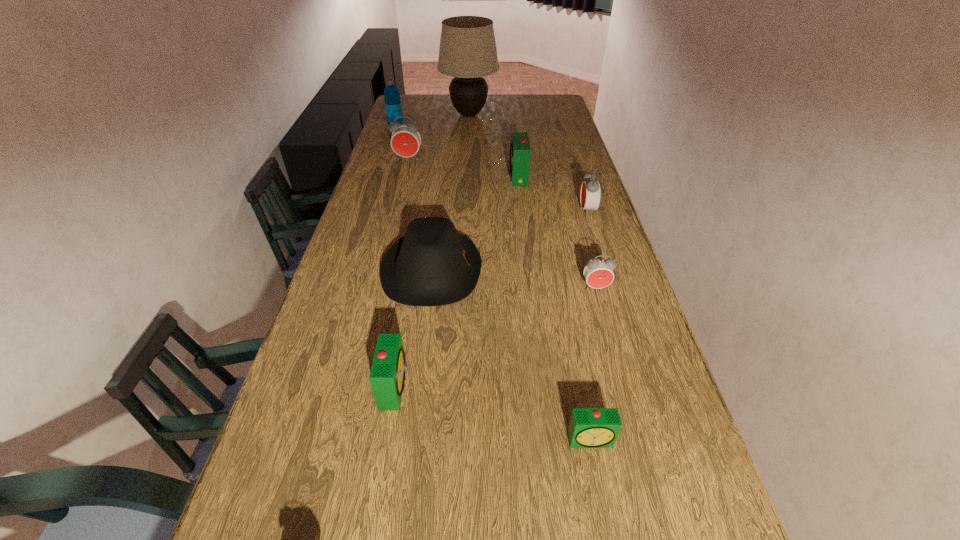
Where is `alarm clock present at the left edge`? alarm clock present at the left edge is located at coordinates (405, 141).

Image resolution: width=960 pixels, height=540 pixels. I want to click on fedora that is at the left edge, so click(x=431, y=265).

The image size is (960, 540). Find the location of `free space at the far edge of the desktop`. free space at the far edge of the desktop is located at coordinates (448, 111).

This screenshot has width=960, height=540. Identify the location of free space at the left edge of the desktop. (361, 369).

Identify the location of vacant space at the right edge of the desktop. tap(548, 156).

Locate an element on the screen. This screenshot has width=960, height=540. empty space that is in between the seventh object from left to right and the gray fedora is located at coordinates (512, 356).

You are a GUI agent. You are given a task and a screenshot of the screen. Output one action in this format:
    pyautogui.click(x=<x>, y=<y>)
    Task: Click on the blank region between the fourth farthest alarm clock and the tallest alarm clock
    The height and width of the screenshot is (540, 960).
    Given the screenshot: What is the action you would take?
    pyautogui.click(x=502, y=224)

You are a GUI agent. You are given a task and a screenshot of the screen. Output one action in this format:
    pyautogui.click(x=<x>, y=<y>)
    Task: Click on the vacant area that lies between the gray fedora and the lampshade
    The height and width of the screenshot is (540, 960).
    Given the screenshot: What is the action you would take?
    coord(450,193)

I want to click on vacant space in between the nearest object and the gray fedora, so click(x=512, y=356).

What are the coordinates of `empty space that is in between the farthest green alarm clock and the gray fedora` in the screenshot? It's located at (475, 225).